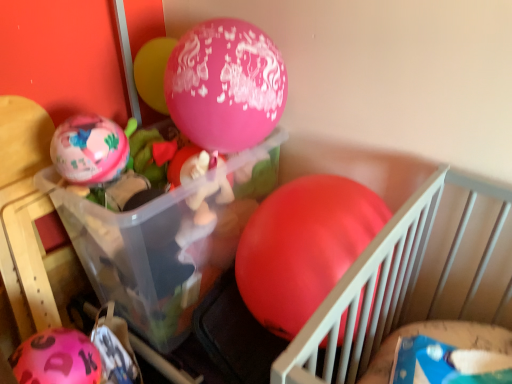
Question: Which direction should I rotate to look at rubber matte balloon at center, which is the first balloon in right-to-left order?

Choices:
 (A) right
 (B) left

Answer: (A)

Question: Does rubber matte balloon at center, positioned as the 4th balloon in left-to-right order, have a lesser height compared to transparent plastic container at center?

Choices:
 (A) no
 (B) yes

Answer: (B)

Question: Is the depth of rubber matte balloon at center, positioned as the 4th balloon in left-to-right order, less than that of transparent plastic container at center?

Choices:
 (A) no
 (B) yes

Answer: (B)

Question: Is rubber matte balloon at center, positioned as the 4th balloon in left-to-right order, smaller than transparent plastic container at center?

Choices:
 (A) no
 (B) yes

Answer: (B)

Question: Does rubber matte balloon at center, which is the first balloon in right-to-left order, have a lesser width compared to transparent plastic container at center?

Choices:
 (A) yes
 (B) no

Answer: (B)

Question: Would you say rubber matte balloon at center, which is the first balloon in right-to-left order, is outside transparent plastic container at center?

Choices:
 (A) no
 (B) yes

Answer: (B)

Question: Does rubber matte balloon at center, which is the first balloon in right-to-left order, lie behind transparent plastic container at center?

Choices:
 (A) no
 (B) yes

Answer: (A)

Question: Does matte pink balloon at left, which is the third balloon from right to left, have a smaller size compared to rubber matte balloon at center, which is the first balloon in right-to-left order?

Choices:
 (A) yes
 (B) no

Answer: (A)

Question: From the image's perspective, is matte pink balloon at left, which is the third balloon from right to left, below rubber matte balloon at center, which is the first balloon in right-to-left order?

Choices:
 (A) yes
 (B) no

Answer: (B)

Question: Is the position of matte pink balloon at left, which is the third balloon from right to left, more distant than that of rubber matte balloon at center, positioned as the 4th balloon in left-to-right order?

Choices:
 (A) no
 (B) yes

Answer: (B)

Question: Does matte pink balloon at left, which is the third balloon from right to left, have a lesser width compared to rubber matte balloon at center, which is the first balloon in right-to-left order?

Choices:
 (A) yes
 (B) no

Answer: (A)

Question: Does matte pink balloon at left, placed as the second balloon when sorted from left to right, have a lesser height compared to rubber matte balloon at center, positioned as the 4th balloon in left-to-right order?

Choices:
 (A) no
 (B) yes

Answer: (B)

Question: Is matte pink balloon at left, which is the third balloon from right to left, not within rubber matte balloon at center, which is the first balloon in right-to-left order?

Choices:
 (A) yes
 (B) no

Answer: (A)

Question: Is the depth of pink matte balloon at lower left, the 1th balloon positioned from the left, greater than that of transparent plastic container at center?

Choices:
 (A) no
 (B) yes

Answer: (A)